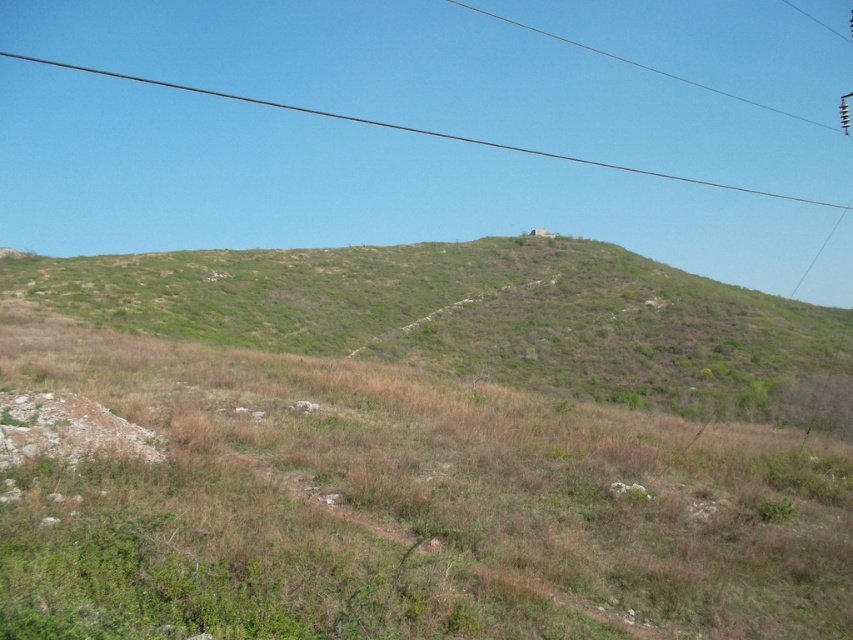
Looking at this image, you are standing at the camera position looking at the landscape. There are two points marked in the image, one at point coordinates point (117, 307) and the other at point coordinates point (828, 202). Which point is closer to you?

Point (117, 307) is closer to the camera than point (828, 202).

You are a hiker trying to navigate through the landscape shown. You need to cross from the lower part of the green grassy hillside at center to the area beyond the black wire at upper center. Is the path clear of obstacles between these two points?

The green grassy hillside at center is positioned under the black wire at upper center, meaning there is no obstruction between them. Therefore, the path is clear for crossing.

You are standing at the point labeled point (404,508) in the image, which is on the green grassy hillside at center. Looking around, which direction would you face to see the distant mountain in the background?

The distant mountain is in the background behind the green grassy hillside at center where you are standing, so facing forward would allow you to see it.